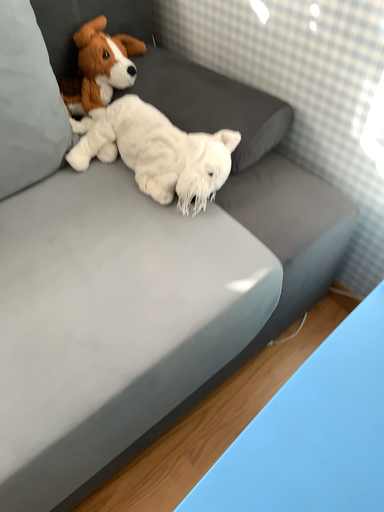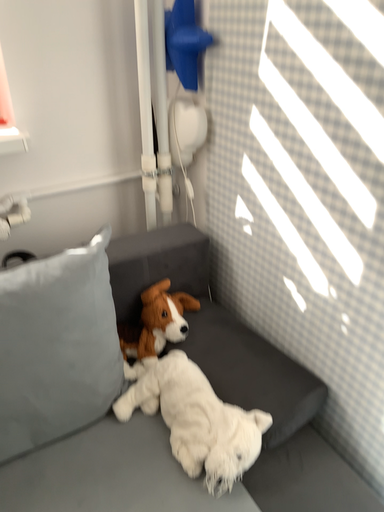
Question: Which way did the camera rotate in the video?

Choices:
 (A) rotated downward
 (B) rotated upward

Answer: (B)